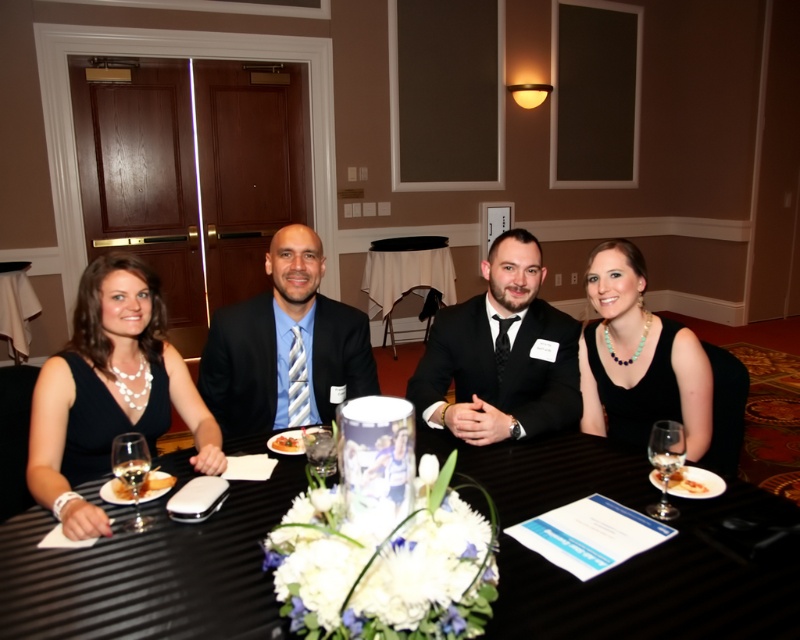
Question: Is matte black dress at left to the left of black satin suit at center from the viewer's perspective?

Choices:
 (A) yes
 (B) no

Answer: (A)

Question: Is matte black table at center above white porcelain plate at lower left?

Choices:
 (A) yes
 (B) no

Answer: (A)

Question: Does black satin suit at center appear on the right side of black satin dress at right?

Choices:
 (A) yes
 (B) no

Answer: (B)

Question: Which object appears farthest from the camera in this image?

Choices:
 (A) matte black dress at left
 (B) matte black suit at center
 (C) black satin suit at center
 (D) clear glass wine glass at lower left

Answer: (B)

Question: Which point is farther from the camera taking this photo?

Choices:
 (A) (220, 413)
 (B) (137, 515)

Answer: (A)

Question: Which point appears farthest from the camera in this image?

Choices:
 (A) coord(490,285)
 (B) coord(658,477)

Answer: (A)